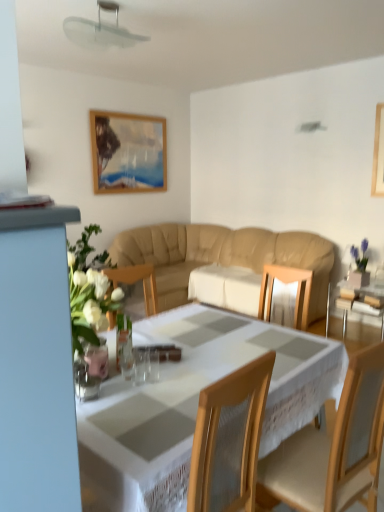
Question: Can you confirm if clear glass vase at lower left is thinner than wooden chair at center?

Choices:
 (A) yes
 (B) no

Answer: (A)

Question: Is clear glass vase at lower left to the left of wooden chair at center from the viewer's perspective?

Choices:
 (A) yes
 (B) no

Answer: (A)

Question: Is clear glass vase at lower left positioned in front of wooden chair at center?

Choices:
 (A) yes
 (B) no

Answer: (B)

Question: Considering the relative sizes of clear glass vase at lower left and wooden chair at center in the image provided, is clear glass vase at lower left smaller than wooden chair at center?

Choices:
 (A) no
 (B) yes

Answer: (B)

Question: Does clear glass vase at lower left appear on the right side of wooden chair at center?

Choices:
 (A) no
 (B) yes

Answer: (A)

Question: Is clear glass vase at lower left shorter than wooden chair at center?

Choices:
 (A) no
 (B) yes

Answer: (B)

Question: From a real-world perspective, is transparent glass table at right under clear glass vase at lower left?

Choices:
 (A) yes
 (B) no

Answer: (A)

Question: Does transparent glass table at right appear on the left side of clear glass vase at lower left?

Choices:
 (A) no
 (B) yes

Answer: (A)

Question: Is clear glass vase at lower left a part of transparent glass table at right?

Choices:
 (A) yes
 (B) no

Answer: (B)

Question: Is transparent glass table at right taller than clear glass vase at lower left?

Choices:
 (A) yes
 (B) no

Answer: (A)

Question: Does transparent glass table at right have a larger size compared to clear glass vase at lower left?

Choices:
 (A) no
 (B) yes

Answer: (B)

Question: Is transparent glass table at right looking in the opposite direction of clear glass vase at lower left?

Choices:
 (A) no
 (B) yes

Answer: (A)

Question: Is the surface of wooden chair at center in direct contact with transparent glass table at right?

Choices:
 (A) yes
 (B) no

Answer: (B)